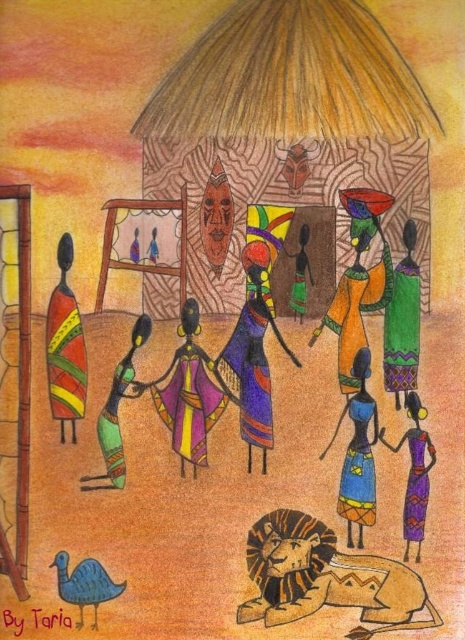
You are a visitor to this village and want to choose a dress to wear for a ceremony. The purple fabric dress at center and the green fabric dress at right are available. Which dress has a wider width?

The purple fabric dress at center has a wider width than the green fabric dress at right.

You are an anthropologist visiting this traditional African village. You notice two items of cultural significance inside the hut. The brown textured lion at lower center and the blue fabric dress at center. Which of these items is larger in size?

The brown textured lion at lower center is bigger than the blue fabric dress at center, so the brown textured lion at lower center is larger in size.